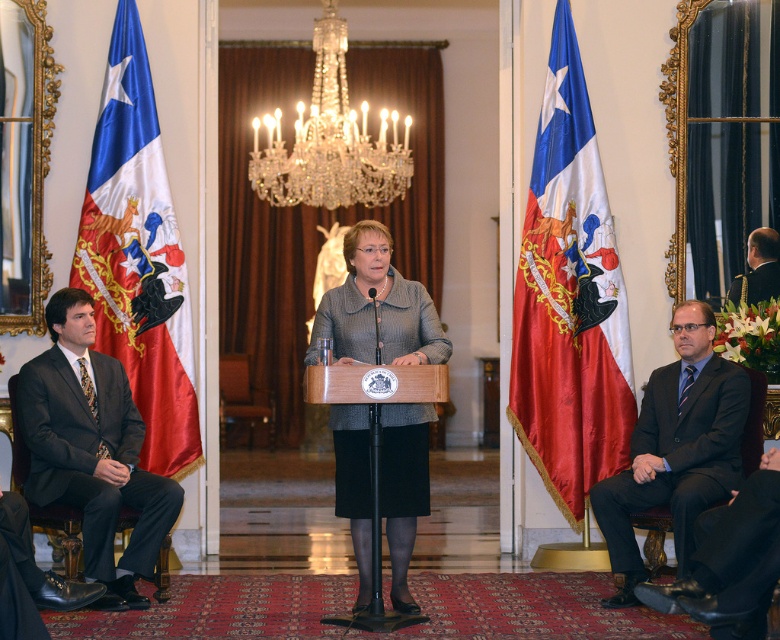
From the picture: Does dark gray suit at left appear on the left side of dark gray suit at right?

Yes, dark gray suit at left is to the left of dark gray suit at right.

Locate an element on the screen. This screenshot has width=780, height=640. dark gray suit at left is located at coordinates click(91, 451).

You are a GUI agent. You are given a task and a screenshot of the screen. Output one action in this format:
    pyautogui.click(x=<x>, y=<y>)
    Task: Click on the dark gray suit at left
    Image resolution: width=780 pixels, height=640 pixels.
    Given the screenshot: What is the action you would take?
    pyautogui.click(x=91, y=451)

Measure the distance between silky red flag at center and camera.

22.82 feet

Does silky red flag at center appear on the right side of silky red flag at left?

Indeed, silky red flag at center is positioned on the right side of silky red flag at left.

Measure the distance between silky red flag at center and camera.

silky red flag at center and camera are 6.96 meters apart from each other.

At what (x,y) coordinates should I click in order to perform the action: click on silky red flag at center. Please return your answer as a coordinate pair (x, y). Image resolution: width=780 pixels, height=640 pixels. Looking at the image, I should click on (569, 300).

Does silky red flag at left have a larger size compared to dark blue suit at right?

Indeed, silky red flag at left has a larger size compared to dark blue suit at right.

Between point (101, 259) and point (738, 284), which one is positioned in front?

Positioned in front is point (101, 259).

Describe the element at coordinates (137, 257) in the screenshot. This screenshot has width=780, height=640. I see `silky red flag at left` at that location.

The image size is (780, 640). I want to click on silky red flag at left, so click(137, 257).